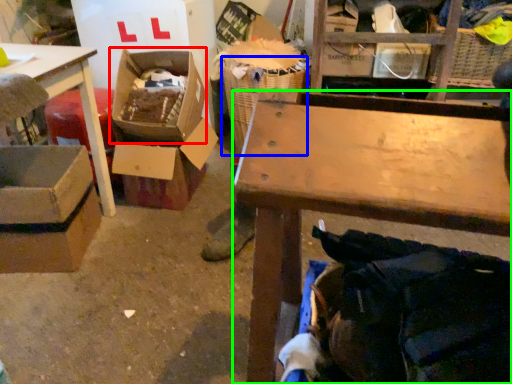
Question: Considering the real-world distances, which object is farthest from storage box (highlighted by a red box)? laundry basket (highlighted by a blue box) or table (highlighted by a green box)?

Choices:
 (A) laundry basket
 (B) table

Answer: (B)